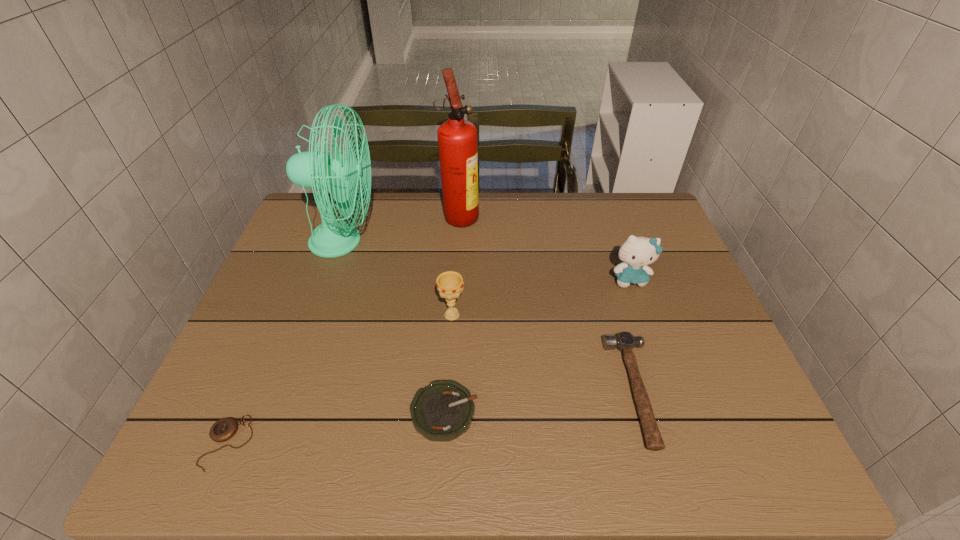
Identify the location of unoccupied area between the third shortest object and the fourth farthest object. (543, 353).

This screenshot has width=960, height=540. Identify the location of free spot between the fourth nearest object and the fire extinguisher. (456, 265).

Where is `unoccupied area between the fan and the fifth shortest object`? Image resolution: width=960 pixels, height=540 pixels. unoccupied area between the fan and the fifth shortest object is located at coordinates [487, 260].

Identify the location of free space between the fifth tallest object and the third tallest object. The image size is (960, 540). (633, 335).

Locate which object ranks sixth in proximity to the shortest object. Please provide its 2D coordinates. Your answer should be formatted as a tuple, i.e. [(x, y)], where the tuple contains the x and y coordinates of a point satisfying the conditions above.

[(636, 253)]

In order to click on object that is the sixth nearest to the fourth tallest object in this screenshot , I will do `click(222, 430)`.

The height and width of the screenshot is (540, 960). Find the location of `free spot that satisfies the following two spatial constraints: 1. on the back side of the chalice; 2. on the right side of the sixth tallest object`. free spot that satisfies the following two spatial constraints: 1. on the back side of the chalice; 2. on the right side of the sixth tallest object is located at coordinates (450, 315).

I want to click on free space that satisfies the following two spatial constraints: 1. on the back side of the fourth nearest object; 2. on the left side of the shortest object, so [282, 315].